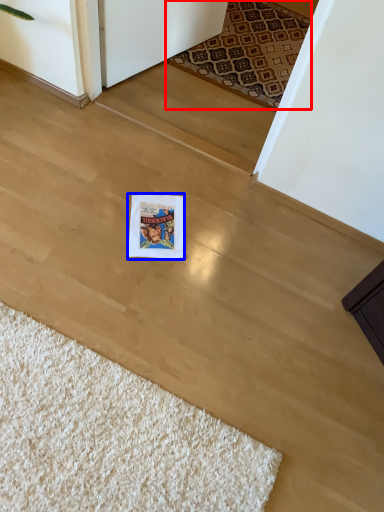
Question: Among these objects, which one is farthest to the camera, mat (highlighted by a red box) or postcard (highlighted by a blue box)?

Choices:
 (A) mat
 (B) postcard

Answer: (A)